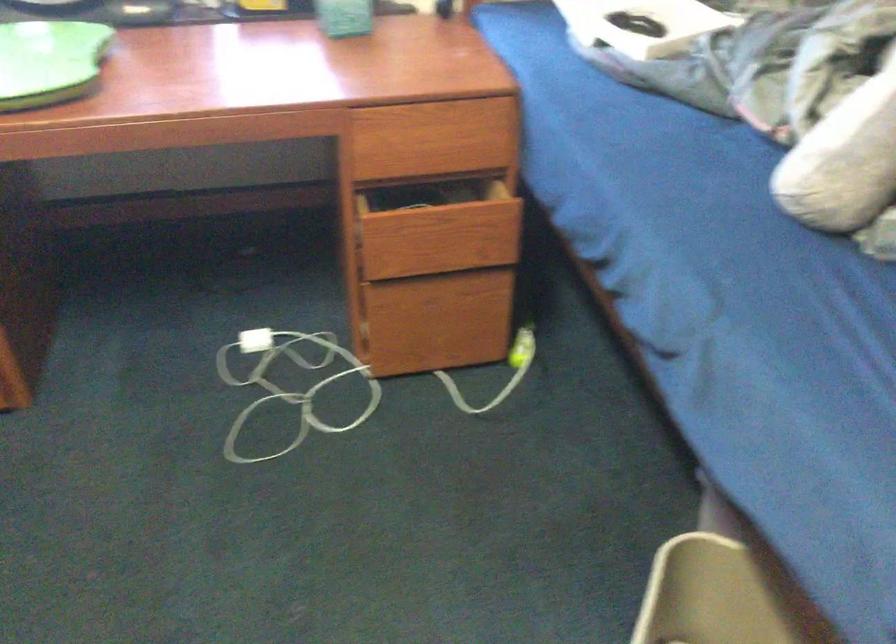
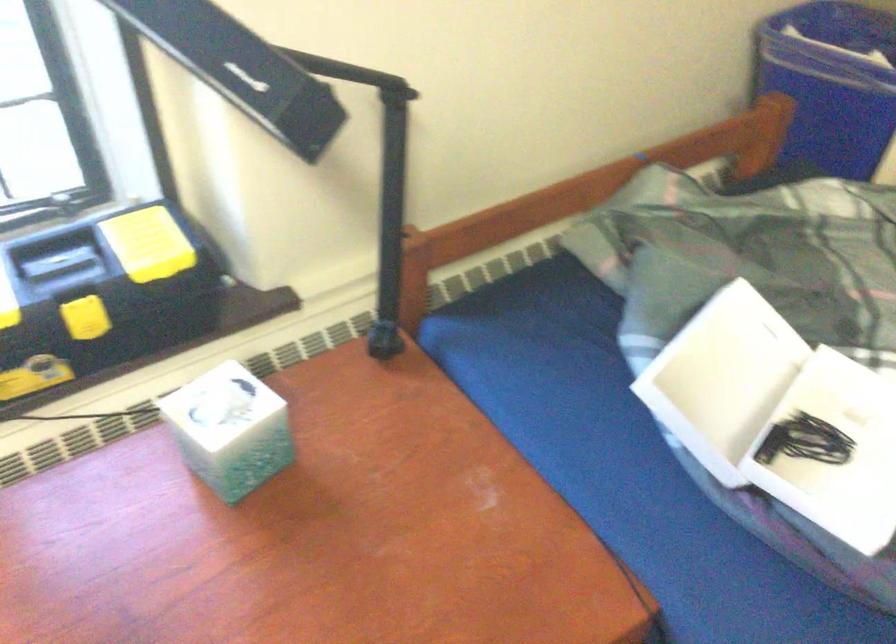
Question: The images are taken continuously from a first-person perspective. In which direction are you moving?

Choices:
 (A) Left
 (B) Right
 (C) Forward
 (D) Backward

Answer: (C)